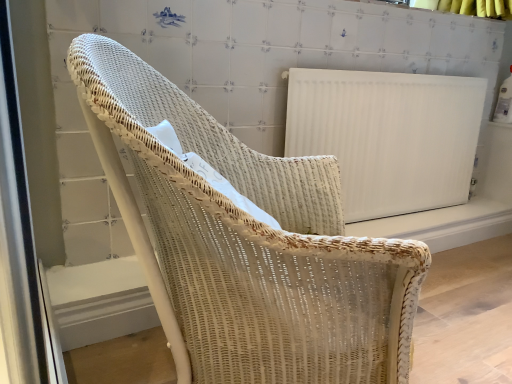
Question: From a real-world perspective, relative to white wicker chair at center, is white ribbed radiator at upper right vertically above or below?

Choices:
 (A) below
 (B) above

Answer: (B)

Question: Considering their positions, is white ribbed radiator at upper right located in front of or behind white wicker chair at center?

Choices:
 (A) behind
 (B) front

Answer: (A)

Question: Considering the positions of point (468, 170) and point (201, 374), is point (468, 170) closer or farther from the camera than point (201, 374)?

Choices:
 (A) farther
 (B) closer

Answer: (A)

Question: Choose the correct answer: Is white wicker chair at center inside white ribbed radiator at upper right or outside it?

Choices:
 (A) inside
 (B) outside

Answer: (B)

Question: Considering the positions of white wicker chair at center and white ribbed radiator at upper right in the image, is white wicker chair at center bigger or smaller than white ribbed radiator at upper right?

Choices:
 (A) big
 (B) small

Answer: (A)

Question: In the image, is white wicker chair at center positioned in front of or behind white ribbed radiator at upper right?

Choices:
 (A) front
 (B) behind

Answer: (A)

Question: From a real-world perspective, is white wicker chair at center above or below white ribbed radiator at upper right?

Choices:
 (A) below
 (B) above

Answer: (A)